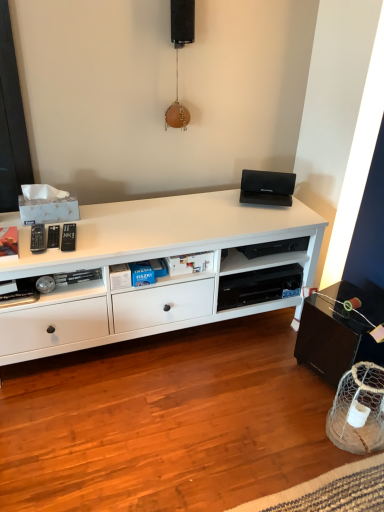
Question: Is black matte speaker at upper center positioned far away from black plastic shelf at center?

Choices:
 (A) no
 (B) yes

Answer: (B)

Question: Can you confirm if black matte speaker at upper center is shorter than black plastic shelf at center?

Choices:
 (A) no
 (B) yes

Answer: (A)

Question: Is black matte speaker at upper center surrounding black plastic shelf at center?

Choices:
 (A) yes
 (B) no

Answer: (B)

Question: Considering the relative sizes of black matte speaker at upper center and black plastic shelf at center in the image provided, is black matte speaker at upper center smaller than black plastic shelf at center?

Choices:
 (A) yes
 (B) no

Answer: (A)

Question: Is black matte speaker at upper center positioned beyond the bounds of black plastic shelf at center?

Choices:
 (A) yes
 (B) no

Answer: (A)

Question: Considering their positions, is white matte cabinet at center located in front of or behind black matte speaker at upper center?

Choices:
 (A) front
 (B) behind

Answer: (A)

Question: From their relative heights in the image, would you say white matte cabinet at center is taller or shorter than black matte speaker at upper center?

Choices:
 (A) short
 (B) tall

Answer: (B)

Question: Considering the positions of white matte cabinet at center and black matte speaker at upper center in the image, is white matte cabinet at center bigger or smaller than black matte speaker at upper center?

Choices:
 (A) small
 (B) big

Answer: (B)

Question: Do you think white matte cabinet at center is within black matte speaker at upper center, or outside of it?

Choices:
 (A) inside
 (B) outside

Answer: (B)

Question: Relative to black plastic shelf at center, is black matte speaker at upper center in front or behind?

Choices:
 (A) behind
 (B) front

Answer: (B)

Question: In terms of width, does black matte speaker at upper center look wider or thinner when compared to black plastic shelf at center?

Choices:
 (A) wide
 (B) thin

Answer: (B)

Question: From a real-world perspective, is black matte speaker at upper center above or below black plastic shelf at center?

Choices:
 (A) above
 (B) below

Answer: (A)

Question: Would you say black matte speaker at upper center is to the left or to the right of black plastic shelf at center in the picture?

Choices:
 (A) left
 (B) right

Answer: (A)

Question: From a real-world perspective, is black matte speaker at upper center physically located above or below white matte cabinet at center?

Choices:
 (A) below
 (B) above

Answer: (B)

Question: From the image's perspective, is black matte speaker at upper center located above or below white matte cabinet at center?

Choices:
 (A) above
 (B) below

Answer: (A)